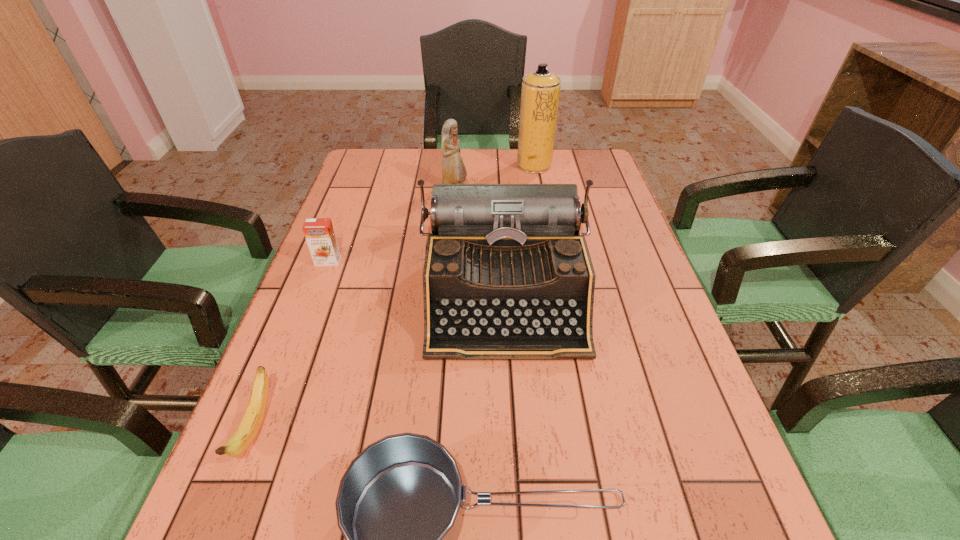
Find the location of `free spot between the typewriter and the banana`. free spot between the typewriter and the banana is located at coordinates (381, 362).

Where is `unoccupied position between the typewriter and the banana`? unoccupied position between the typewriter and the banana is located at coordinates (381, 362).

Find the location of `unoccupied area between the second farthest object and the orange juice`. unoccupied area between the second farthest object and the orange juice is located at coordinates (392, 225).

Where is `vacant area between the fourth tallest object and the typewriter`? This screenshot has width=960, height=540. vacant area between the fourth tallest object and the typewriter is located at coordinates (417, 279).

Identify the location of vacant space that's between the typewriter and the orange juice. click(417, 279).

You are a GUI agent. You are given a task and a screenshot of the screen. Output one action in this format:
    pyautogui.click(x=<x>, y=<y>)
    Task: Click on the free space between the farthest object and the shortest object
    This screenshot has width=960, height=540.
    Given the screenshot: What is the action you would take?
    pyautogui.click(x=396, y=296)

Point out which object is positioned as the second nearest to the second farthest object. Please provide its 2D coordinates. Your answer should be formatted as a tuple, i.e. [(x, y)], where the tuple contains the x and y coordinates of a point satisfying the conditions above.

[(507, 275)]

Identify which object is the closest to the figurine. Please provide its 2D coordinates. Your answer should be formatted as a tuple, i.e. [(x, y)], where the tuple contains the x and y coordinates of a point satisfying the conditions above.

[(540, 91)]